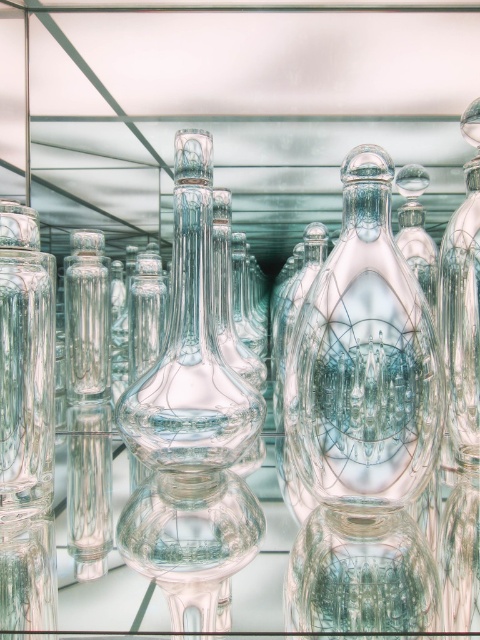
You are holding a small toy that is 12 inches long. You want to place it inside the transparent glass vase at center. Can the toy fit inside the vase?

The transparent glass vase at center is 18.01 inches away from the viewer, but the distance does not indicate the vase size. The question about the toy fitting cannot be answered with the given information.

You are an interior designer arranging a mirrored display case. You have a transparent glass vase at center and a transparent glass bottle at right. Which object is positioned lower in the display case?

The transparent glass vase at center is located below the transparent glass bottle at right, so it is positioned lower in the display case.

You are a delivery person who needs to retrieve the transparent glass bottle at right from the mirrored display case. To avoid breaking it, you must ensure that you do not touch the transparent glass vase at center. How should you approach the display case?

The transparent glass vase at center is in front of the transparent glass bottle at right, so you should carefully move around the sides of the transparent glass vase at center to access the transparent glass bottle at right without touching it.